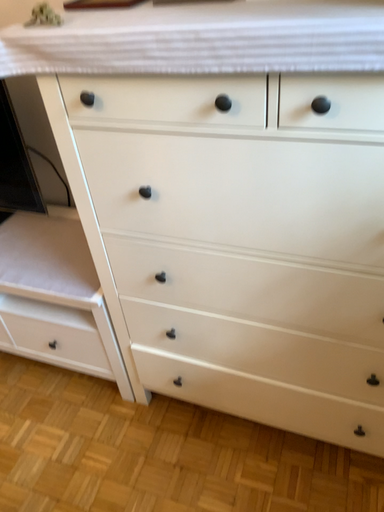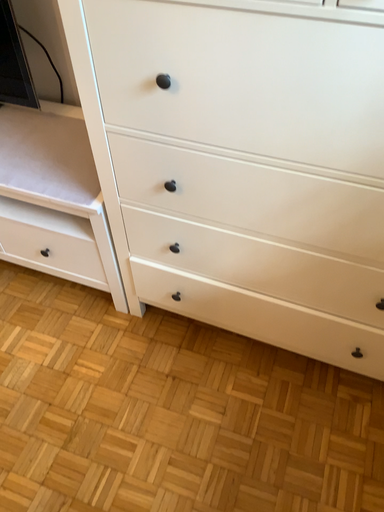
Question: How did the camera likely rotate when shooting the video?

Choices:
 (A) rotated upward
 (B) rotated downward

Answer: (B)